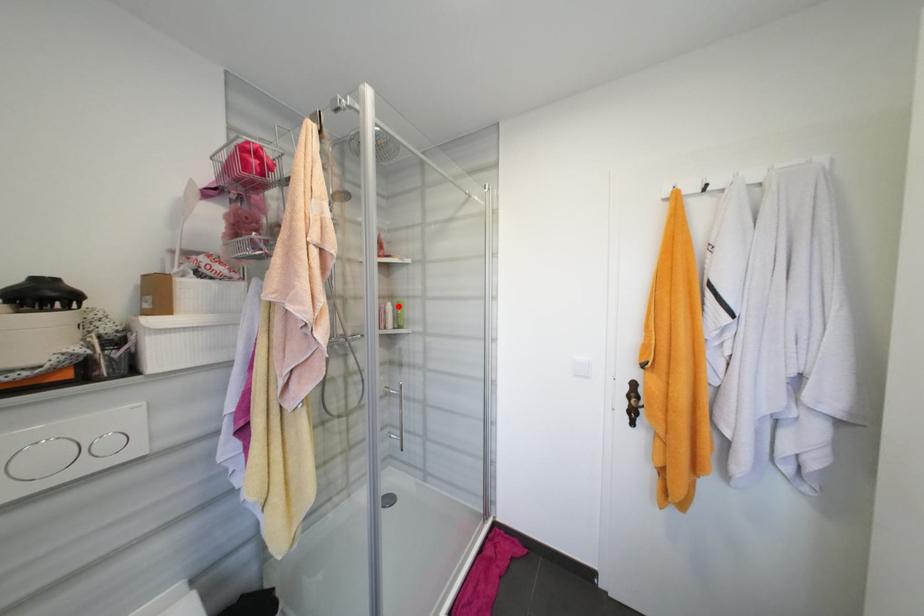
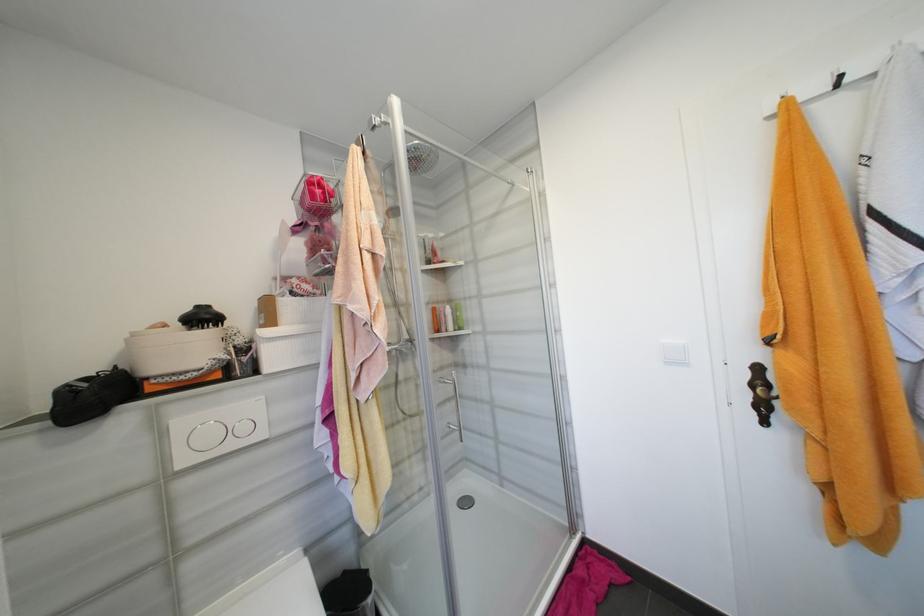
In the second image, find the point that corresponds to the highlighted location in the first image.

(457, 309)